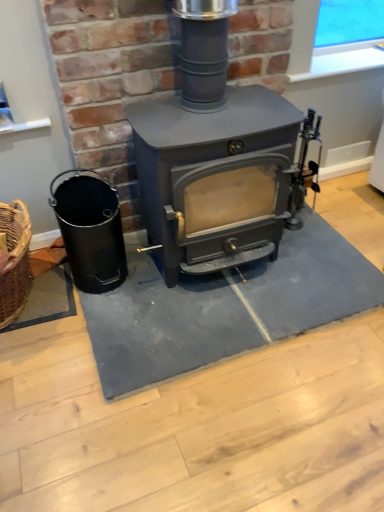
Find the location of `free space on the front side of matte gray wood burning stove at center`. free space on the front side of matte gray wood burning stove at center is located at coordinates click(248, 388).